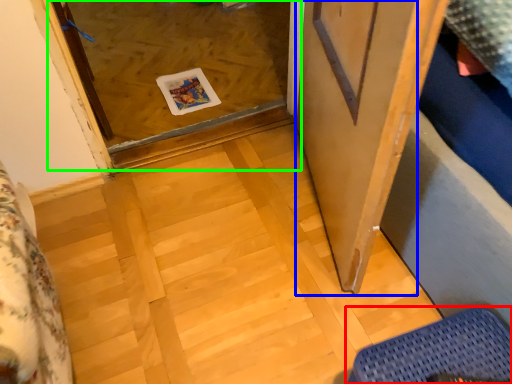
Question: Which object is positioned closest to furniture (highlighted by a red box)? Select from screen door (highlighted by a blue box) and glass door (highlighted by a green box).

Choices:
 (A) screen door
 (B) glass door

Answer: (A)